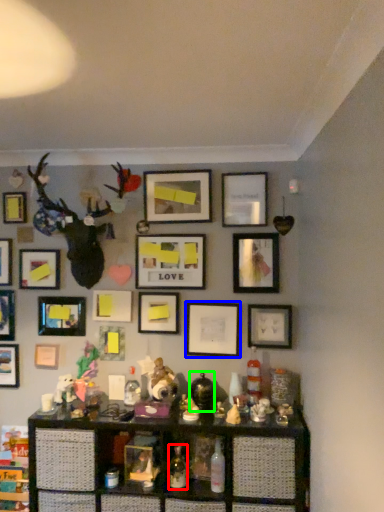
Question: Which is farther away from bottle (highlighted by a red box)? picture frame (highlighted by a blue box) or toy (highlighted by a green box)?

Choices:
 (A) picture frame
 (B) toy

Answer: (A)